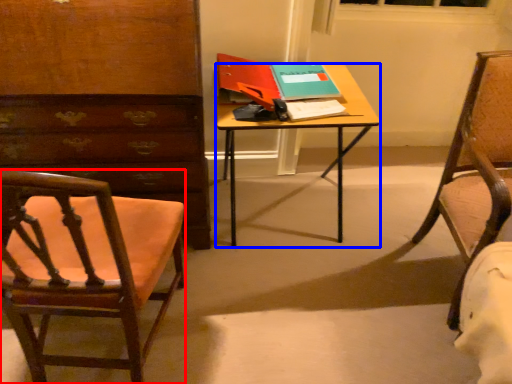
Question: Among these objects, which one is farthest to the camera, chair (highlighted by a red box) or desk (highlighted by a blue box)?

Choices:
 (A) chair
 (B) desk

Answer: (B)